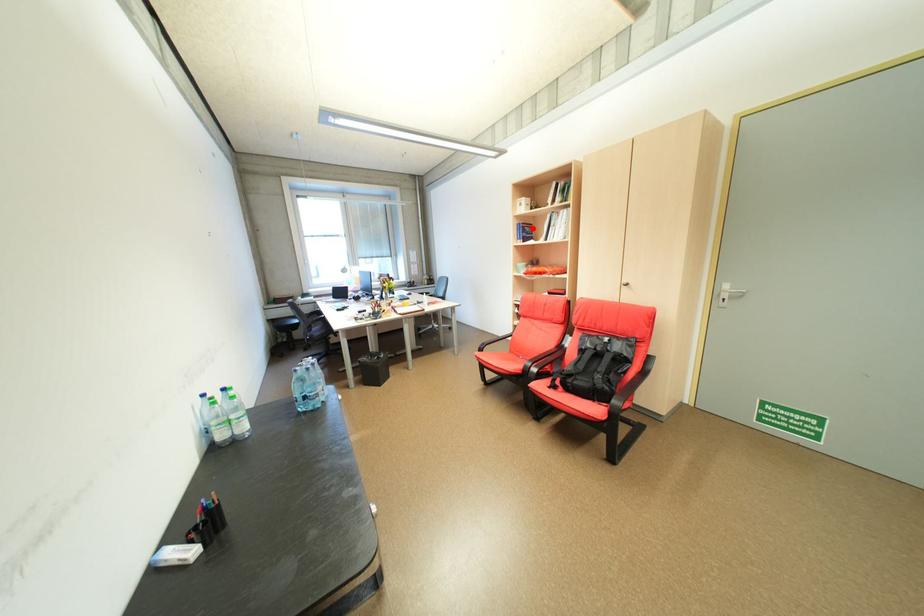
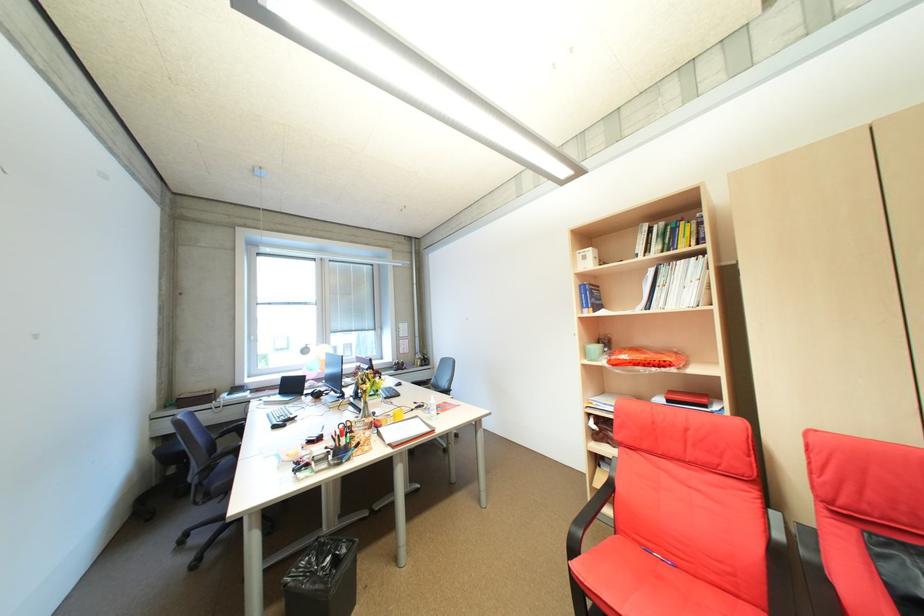
Where in the second image is the point corresponding to the highlighted location from the first image?

(600, 291)